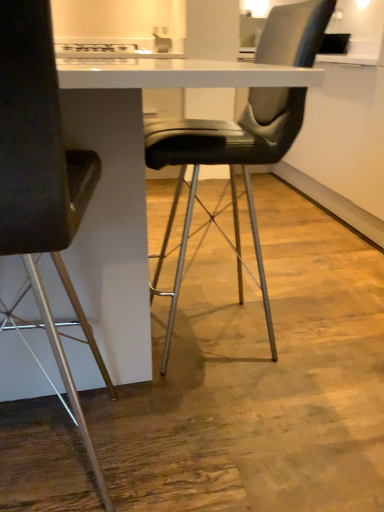
You are a GUI agent. You are given a task and a screenshot of the screen. Output one action in this format:
    pyautogui.click(x=<x>, y=<y>)
    Task: Click on the vacant area on the back side of black leather chair at center, the first chair positioned from the right
    The width and height of the screenshot is (384, 512).
    Given the screenshot: What is the action you would take?
    tap(243, 274)